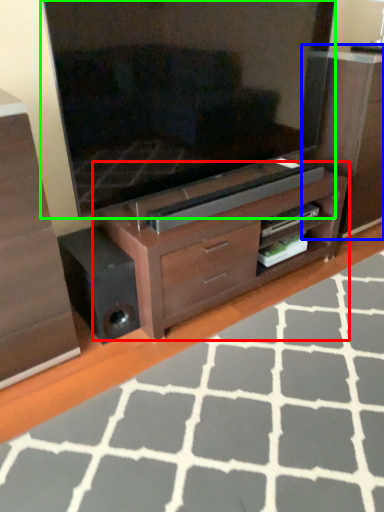
Question: Based on their relative distances, which object is nearer to tv cabinet (highlighted by a red box)? Choose from dresser (highlighted by a blue box) and television (highlighted by a green box).

Choices:
 (A) dresser
 (B) television

Answer: (B)